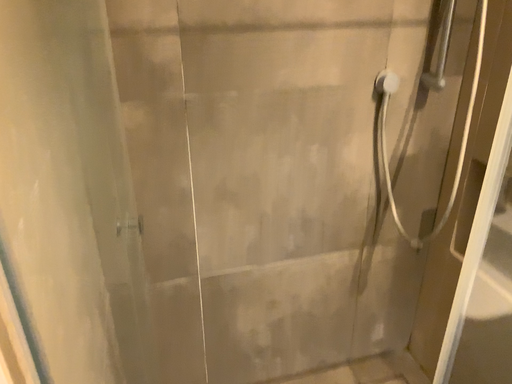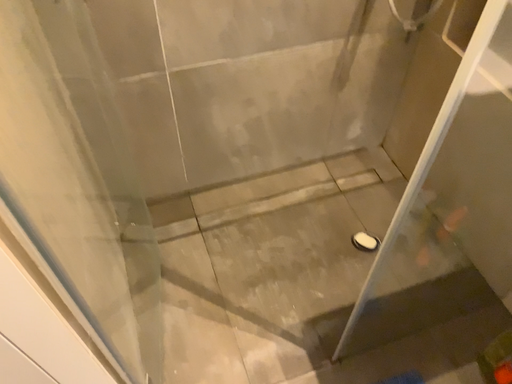
Question: How did the camera likely rotate when shooting the video?

Choices:
 (A) rotated downward
 (B) rotated upward

Answer: (A)